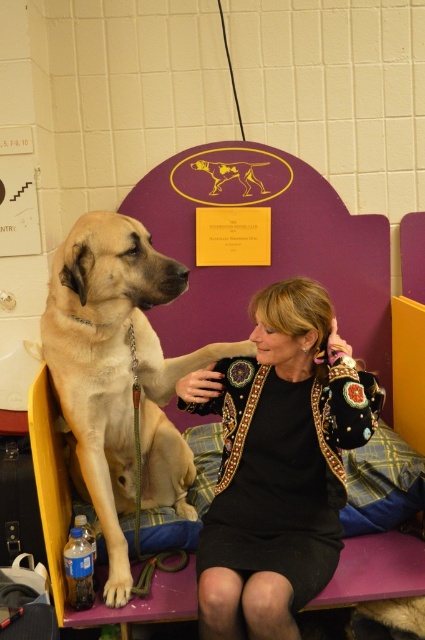
Is black textured jacket at center thinner than light brown fur at left?

Yes.

Between black textured jacket at center and light brown fur at left, which one appears on the left side from the viewer's perspective?

light brown fur at left

The image size is (425, 640). What do you see at coordinates (277, 464) in the screenshot?
I see `black textured jacket at center` at bounding box center [277, 464].

At what (x,y) coordinates should I click in order to perform the action: click on black textured jacket at center. Please return your answer as a coordinate pair (x, y). This screenshot has height=640, width=425. Looking at the image, I should click on pos(277,464).